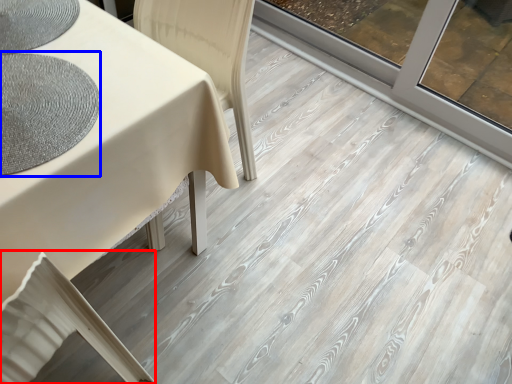
Question: Which point is closer to the camera, swivel chair (highlighted by a red box) or mat (highlighted by a blue box)?

Choices:
 (A) swivel chair
 (B) mat

Answer: (A)